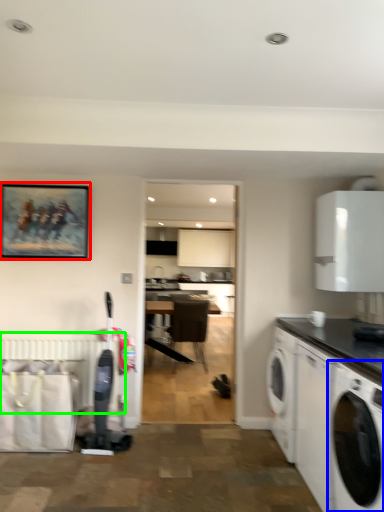
Question: Which object is the closest to the picture frame (highlighted by a red box)? Choose among these: washing machine (highlighted by a blue box) or radiator (highlighted by a green box).

Choices:
 (A) washing machine
 (B) radiator

Answer: (B)